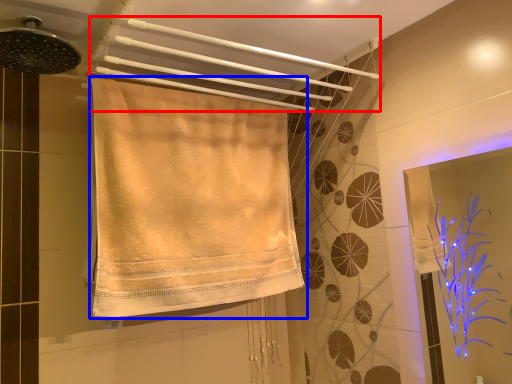
Question: Which point is closer to the camera, towel (highlighted by a red box) or towel (highlighted by a blue box)?

Choices:
 (A) towel
 (B) towel

Answer: (A)